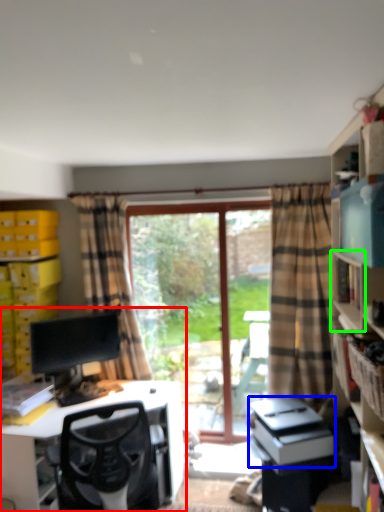
Question: Which object is positioned farthest from entertainment center (highlighted by a red box)? Select from printer (highlighted by a blue box) and shelf (highlighted by a green box).

Choices:
 (A) printer
 (B) shelf

Answer: (B)